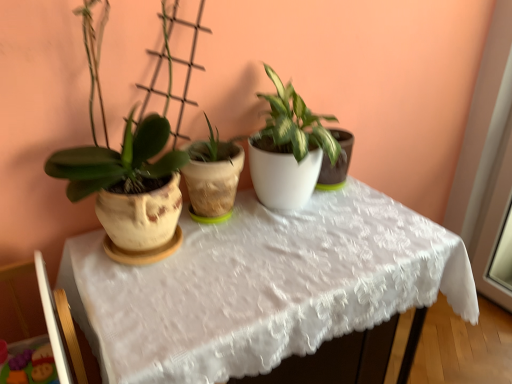
This screenshot has width=512, height=384. In order to click on spots to the right of matte clay pot at left in this screenshot , I will do `click(238, 265)`.